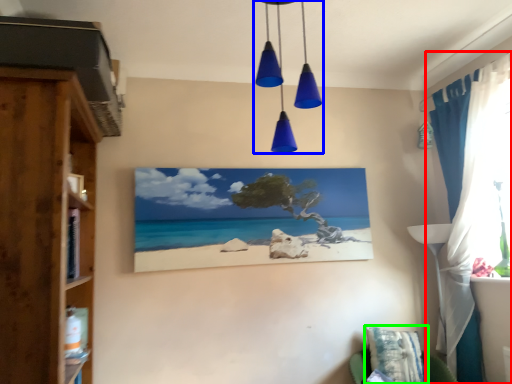
Question: Which object is the farthest from curtain (highlighted by a red box)? Choose among these: light fixture (highlighted by a blue box) or pillow (highlighted by a green box).

Choices:
 (A) light fixture
 (B) pillow

Answer: (A)